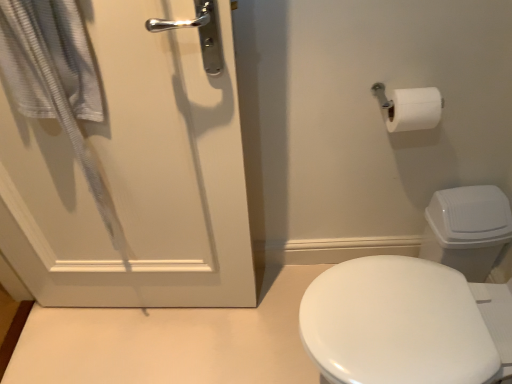
Locate an element on the screen. The height and width of the screenshot is (384, 512). vacant region under white matte door at left (from a real-world perspective) is located at coordinates (154, 308).